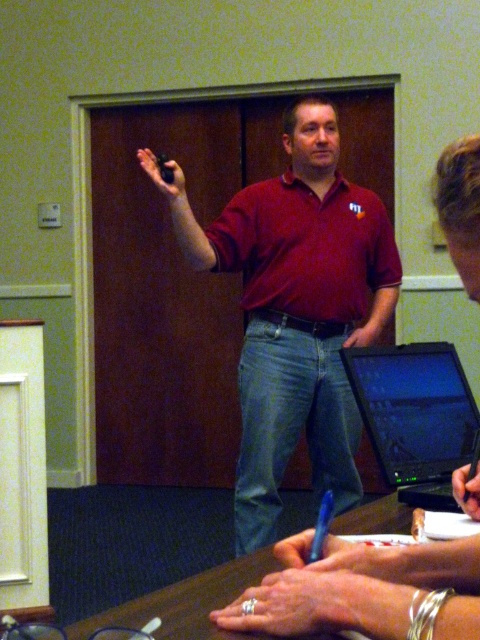
Does brown wooden table at lower center appear under blue plastic pen at lower center?

No.

Is brown wooden table at lower center smaller than blue plastic pen at lower center?

No, brown wooden table at lower center is not smaller than blue plastic pen at lower center.

Is point (422, 560) positioned after point (328, 512)?

No.

Where is `brown wooden table at lower center`? The image size is (480, 640). brown wooden table at lower center is located at coordinates (406, 563).

Who is taller, black glossy laptop at center or blue plastic pen at lower center?

black glossy laptop at center is taller.

Does black glossy laptop at center have a greater height compared to blue plastic pen at lower center?

Indeed, black glossy laptop at center has a greater height compared to blue plastic pen at lower center.

Between point (455, 458) and point (314, 554), which one is positioned in front?

Positioned in front is point (314, 554).

Image resolution: width=480 pixels, height=640 pixels. Find the location of `black glossy laptop at center`. black glossy laptop at center is located at coordinates (415, 417).

Between matte red shirt at center and blue plastic pen at lower center, which one has more height?

matte red shirt at center is taller.

Is point (266, 285) behind point (322, 552)?

Yes, it is.

The width and height of the screenshot is (480, 640). I want to click on matte red shirt at center, so (296, 308).